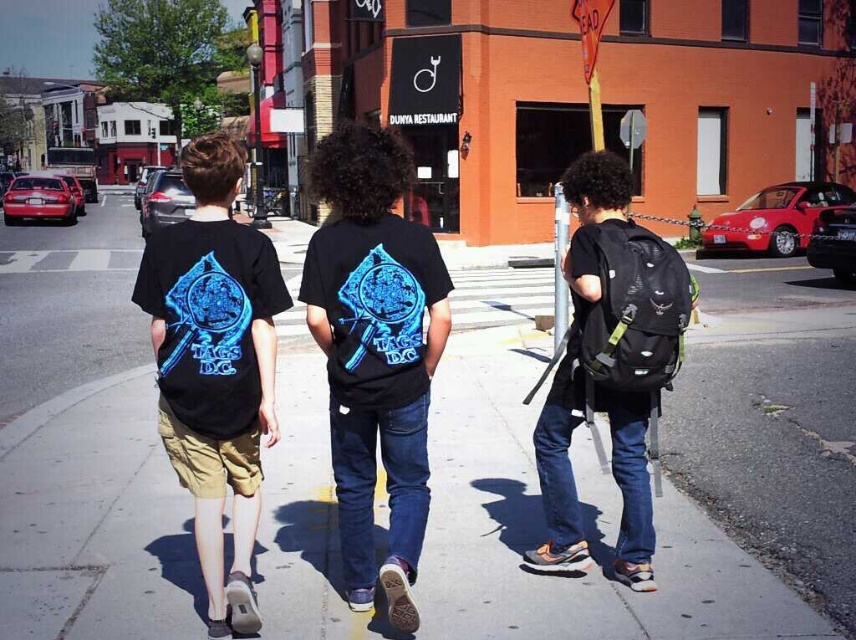
You are standing at the point with coordinates point (x=702, y=516) and want to walk towards point (x=212, y=314). Based on the scene, which direction should you move relative to the camera?

Since point (x=702, y=516) is closer to the viewer than point (x=212, y=314), you should move away from the camera to reach point (x=212, y=314).